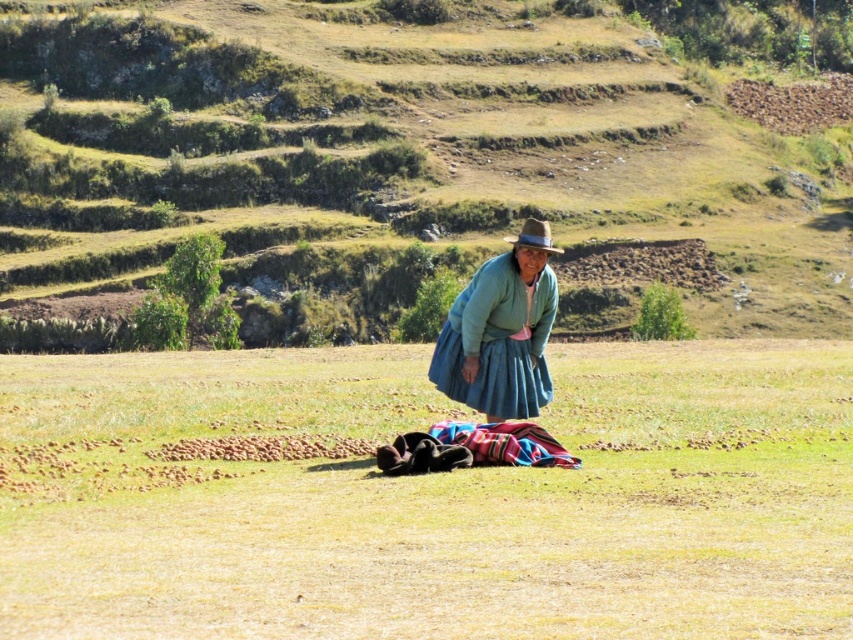
Is blue woven skirt at center to the left of brown felt cowboy hat at center from the viewer's perspective?

Yes, blue woven skirt at center is to the left of brown felt cowboy hat at center.

The height and width of the screenshot is (640, 853). I want to click on blue woven skirt at center, so click(502, 332).

Between green grass at center and brown felt cowboy hat at center, which one has more height?

brown felt cowboy hat at center

The height and width of the screenshot is (640, 853). Find the location of `green grass at center`. green grass at center is located at coordinates click(x=425, y=497).

Which of these two, green grass at center or multicolored woven cloth at center, stands taller?

green grass at center

Which is below, green grass at center or multicolored woven cloth at center?

multicolored woven cloth at center is below.

Is point (782, 369) positioned after point (572, 456)?

Yes, point (782, 369) is farther from viewer.

The image size is (853, 640). In order to click on green grass at center in this screenshot , I will do `click(425, 497)`.